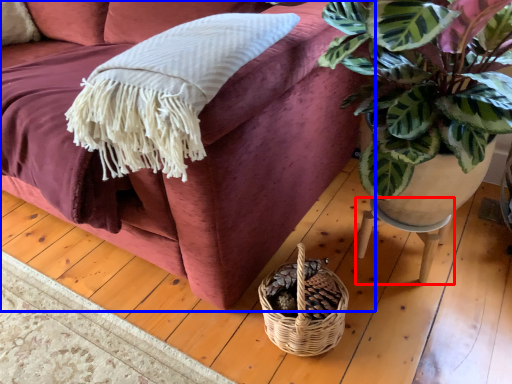
Question: Which object is closer to the camera taking this photo, table (highlighted by a red box) or studio couch (highlighted by a blue box)?

Choices:
 (A) table
 (B) studio couch

Answer: (B)